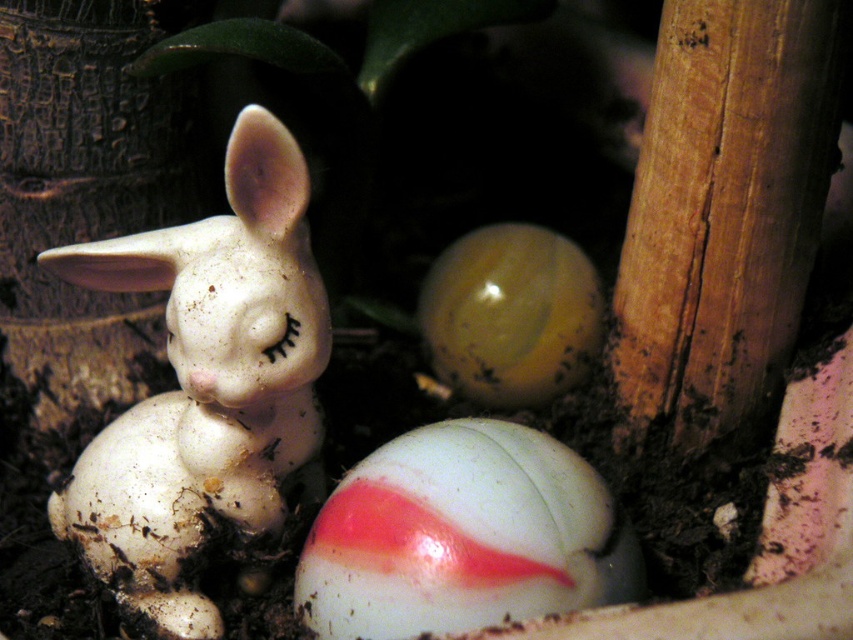
Can you confirm if white matte rabbit at center is smaller than translucent yellow egg at center?

Actually, white matte rabbit at center might be larger than translucent yellow egg at center.

Does point (316, 433) lie behind point (577, 371)?

No, (316, 433) is closer to viewer.

What are the coordinates of `white matte rabbit at center` in the screenshot? It's located at (206, 385).

What do you see at coordinates (463, 536) in the screenshot? I see `white glossy egg at center` at bounding box center [463, 536].

Who is more forward, (612, 536) or (430, 333)?

Point (612, 536)

Is point (589, 557) closer to viewer compared to point (471, 333)?

Yes, point (589, 557) is closer to viewer.

Find the location of a particular element. Image resolution: width=853 pixels, height=640 pixels. white glossy egg at center is located at coordinates (463, 536).

In the scene shown: Between white matte rabbit at center and white glossy egg at center, which one is positioned higher?

white matte rabbit at center is above.

This screenshot has width=853, height=640. Find the location of `white matte rabbit at center`. white matte rabbit at center is located at coordinates (206, 385).

Between point (282, 128) and point (489, 611), which one is positioned behind?

Positioned behind is point (282, 128).

Locate an element on the screen. The width and height of the screenshot is (853, 640). white matte rabbit at center is located at coordinates (206, 385).